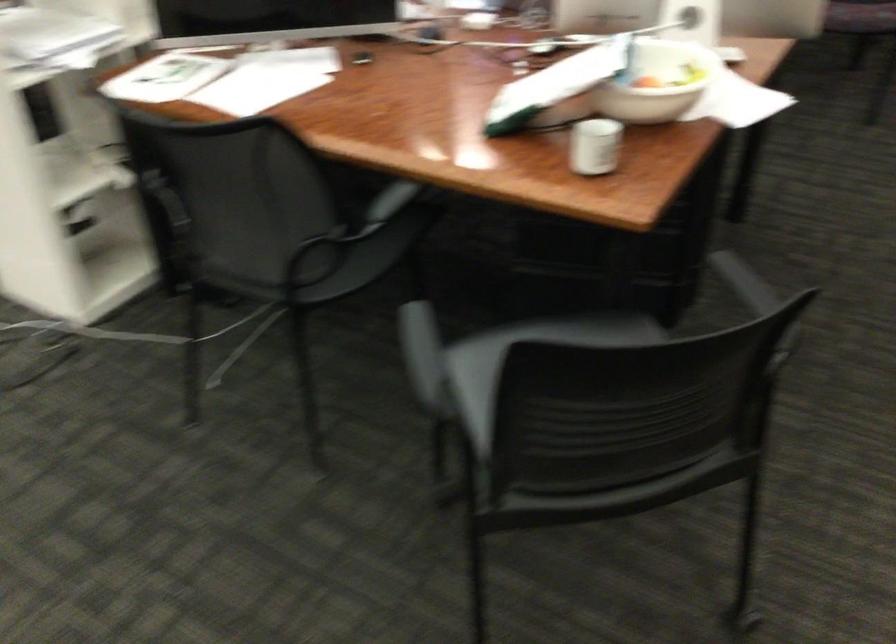
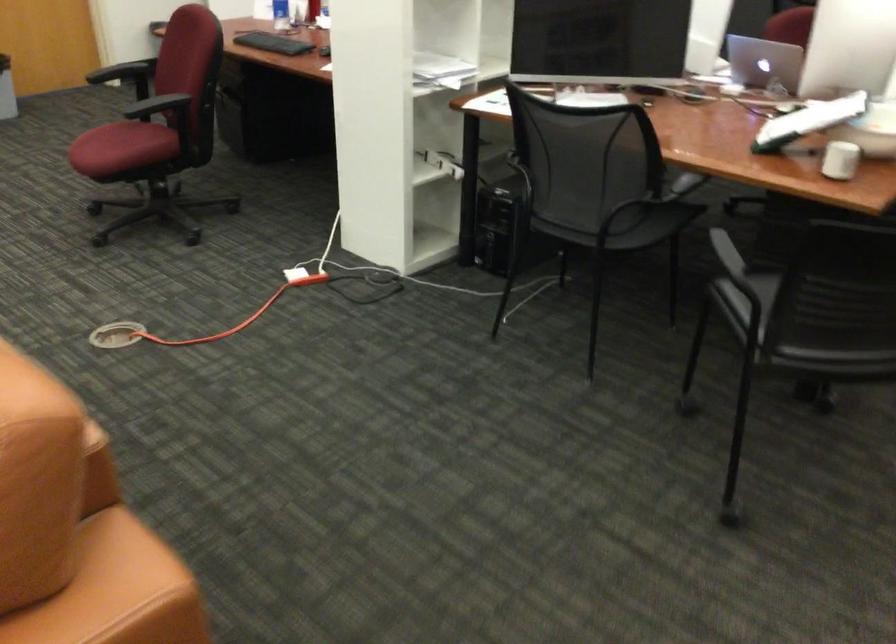
Locate, in the second image, the point that corresponds to the point at 601,158 in the first image.

(840, 160)